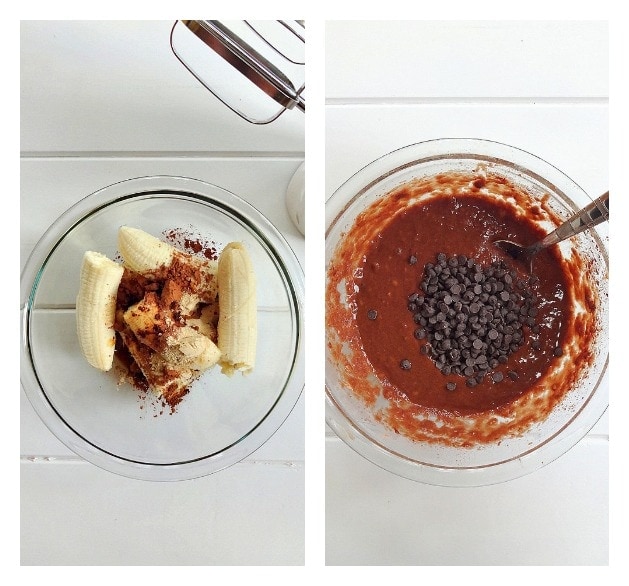
Identify the location of glass. (238, 415), (382, 449).